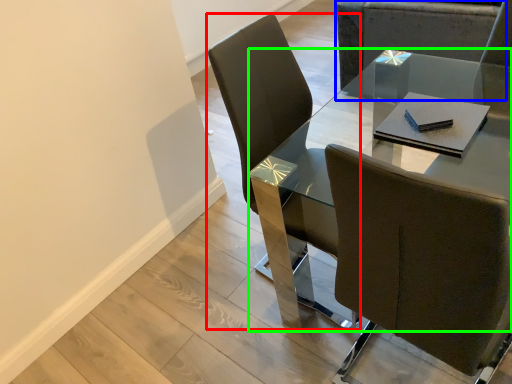
Question: Which object is positioned closest to chair (highlighted by a red box)? Select from chair (highlighted by a blue box) and table (highlighted by a green box).

Choices:
 (A) chair
 (B) table

Answer: (B)